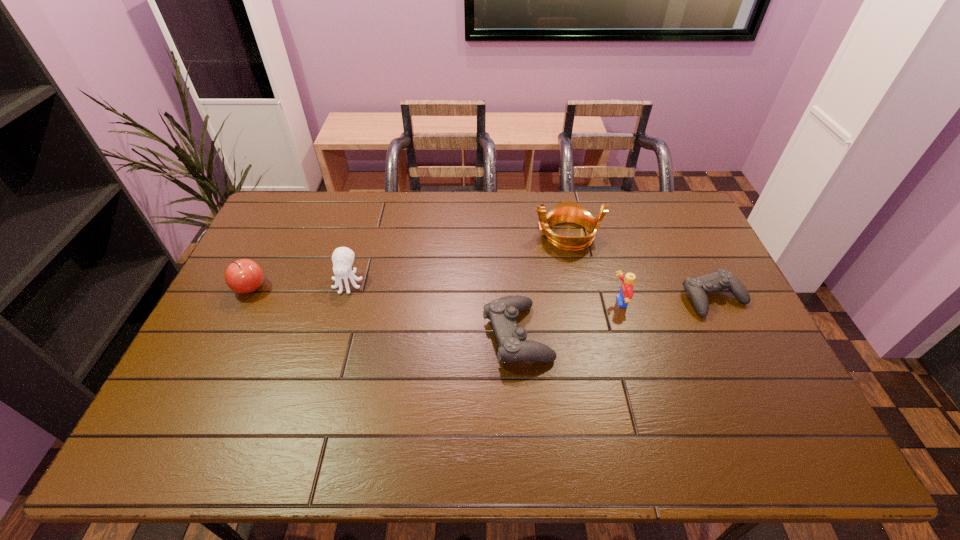
I want to click on the second shortest object, so click(513, 347).

The height and width of the screenshot is (540, 960). Find the location of `the left control`. the left control is located at coordinates (513, 347).

Where is `the shortest object`? The width and height of the screenshot is (960, 540). the shortest object is located at coordinates (698, 287).

Image resolution: width=960 pixels, height=540 pixels. Find the location of `the rightmost object`. the rightmost object is located at coordinates (698, 287).

At what (x,y) coordinates should I click in order to perform the action: click on the farthest object. Please return your answer as a coordinate pair (x, y). The width and height of the screenshot is (960, 540). Looking at the image, I should click on (567, 211).

Find the location of a particular element. This screenshot has width=960, height=540. octopus is located at coordinates (343, 257).

You are a GUI agent. You are given a task and a screenshot of the screen. Output one action in this format:
    pyautogui.click(x=<x>, y=<y>)
    Task: Click on the Lego
    
    Given the screenshot: What is the action you would take?
    pyautogui.click(x=626, y=289)

This screenshot has height=540, width=960. Find the location of `the leftmost object`. the leftmost object is located at coordinates (243, 276).

Locate an element on the screen. vacant space located 0.170m on the left of the left control is located at coordinates (422, 335).

Find the location of a particular element. free space located on the back of the rightmost object is located at coordinates (672, 212).